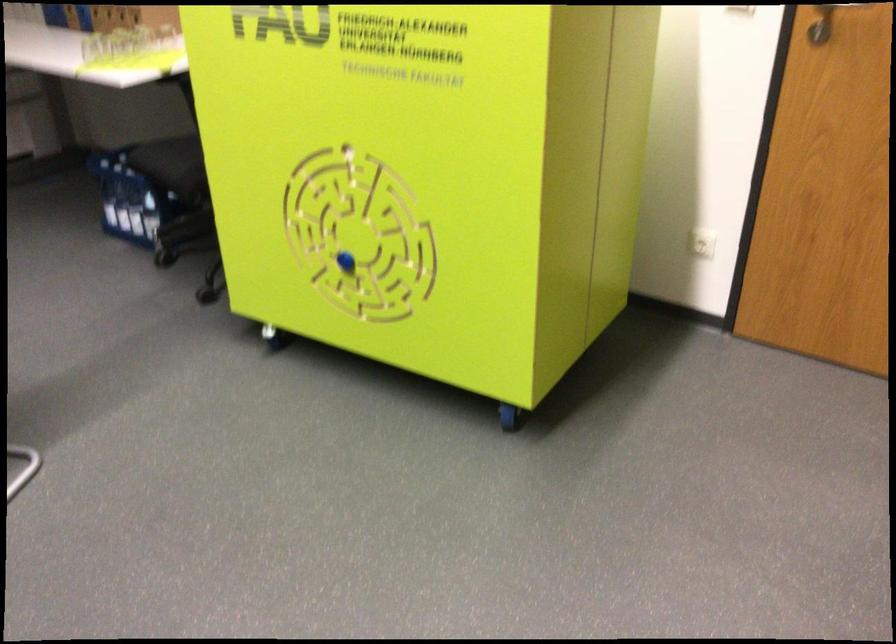
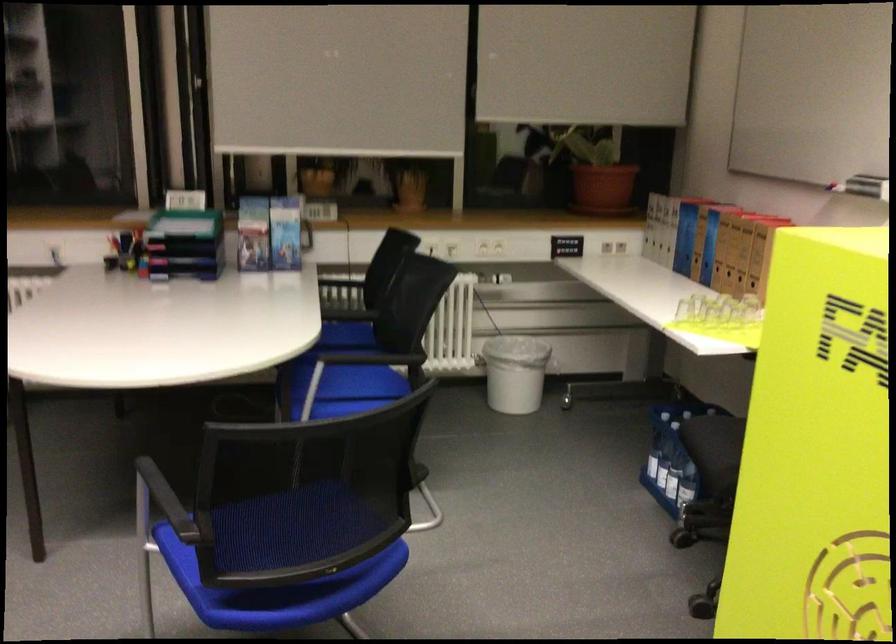
Locate, in the second image, the point that corresponds to pixel 125 210 in the first image.

(661, 465)